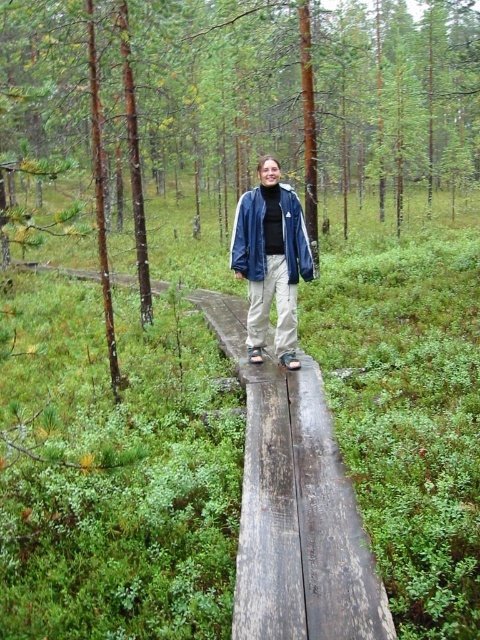
Question: Does brown wood tree at center have a larger size compared to matte blue jacket at center?

Choices:
 (A) yes
 (B) no

Answer: (A)

Question: Estimate the real-world distances between objects in this image. Which object is closer to the blue denim jacket at center?

Choices:
 (A) brown wood tree at center
 (B) matte blue jacket at center

Answer: (B)

Question: Observing the image, what is the correct spatial positioning of brown wood tree at center in reference to matte blue jacket at center?

Choices:
 (A) below
 (B) above

Answer: (B)

Question: Is matte blue jacket at center thinner than blue denim jacket at center?

Choices:
 (A) yes
 (B) no

Answer: (B)

Question: Which point is closer to the camera?

Choices:
 (A) matte blue jacket at center
 (B) brown wood tree at center
 (C) blue denim jacket at center

Answer: (B)

Question: Which of the following is the closest to the observer?

Choices:
 (A) (354, 16)
 (B) (310, 269)
 (C) (285, 189)

Answer: (C)